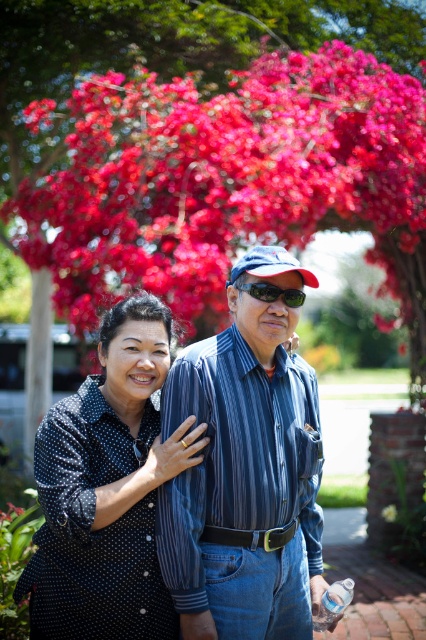
Question: Which point is farther from the camera taking this photo?

Choices:
 (A) (287, 120)
 (B) (268, 294)
 (C) (164, 509)

Answer: (A)

Question: Is blue striped shirt at center wider than sunglasses at center?

Choices:
 (A) yes
 (B) no

Answer: (A)

Question: Which of the following is the closest to the observer?

Choices:
 (A) black dotted shirt at center
 (B) vibrant silk flowers at upper center
 (C) blue striped shirt at center

Answer: (A)

Question: Is vibrant silk flowers at upper center below blue striped shirt at center?

Choices:
 (A) yes
 (B) no

Answer: (B)

Question: Estimate the real-world distances between objects in this image. Which object is farther from the vibrant silk flowers at upper center?

Choices:
 (A) blue striped shirt at center
 (B) sunglasses at center

Answer: (B)

Question: Observing the image, what is the correct spatial positioning of vibrant silk flowers at upper center in reference to blue striped shirt at center?

Choices:
 (A) left
 (B) right

Answer: (A)